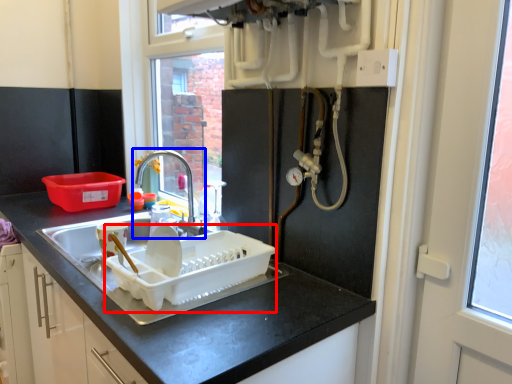
Question: Which object is closer to the camera taking this photo, appliance (highlighted by a red box) or tap (highlighted by a blue box)?

Choices:
 (A) appliance
 (B) tap

Answer: (A)